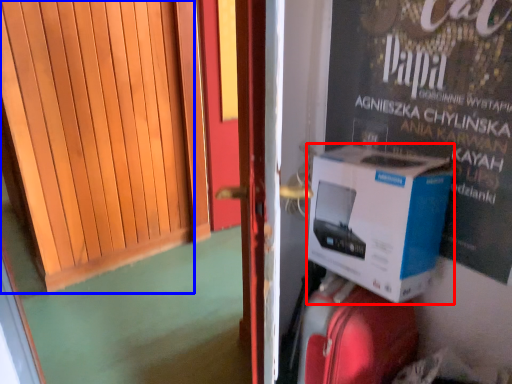
Question: Among these objects, which one is farthest to the camera, box (highlighted by a red box) or door (highlighted by a blue box)?

Choices:
 (A) box
 (B) door

Answer: (A)